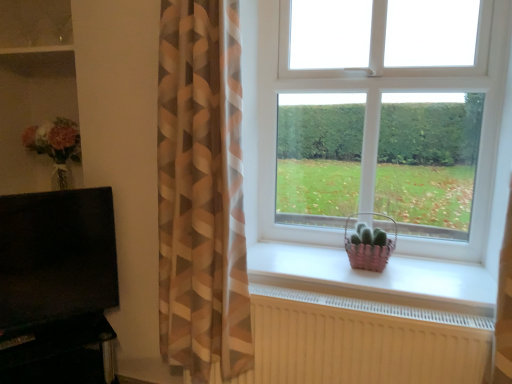
Question: Considering the positions of white matte window sill at center and brown/white striped curtain at left in the image, is white matte window sill at center taller or shorter than brown/white striped curtain at left?

Choices:
 (A) tall
 (B) short

Answer: (B)

Question: Is white matte window sill at center to the left or to the right of brown/white striped curtain at left in the image?

Choices:
 (A) left
 (B) right

Answer: (B)

Question: Estimate the real-world distances between objects in this image. Which object is farther from the black matte tv at left, which is the 1th entertainment center from top to bottom?

Choices:
 (A) white matte window sill at center
 (B) white textured radiator at lower center
 (C) matte glass shelf at upper left
 (D) pink woven basket at window
 (E) black glossy entertainment center at lower left, arranged as the second entertainment center when viewed from the top

Answer: (C)

Question: Which of these objects is positioned closest to the black matte tv at left, arranged as the second entertainment center when ordered from the bottom?

Choices:
 (A) pink woven basket at window
 (B) white plastic window at center
 (C) white matte window sill at center
 (D) matte glass shelf at upper left
 (E) white textured radiator at lower center

Answer: (E)